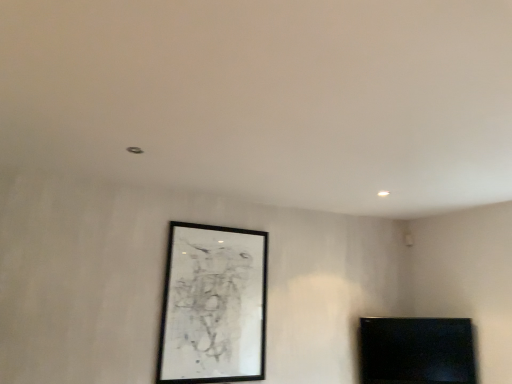
Question: Considering the positions of black matte picture frame at center and black glossy tv at lower right in the image, is black matte picture frame at center bigger or smaller than black glossy tv at lower right?

Choices:
 (A) big
 (B) small

Answer: (A)

Question: Is black matte picture frame at center inside the boundaries of black glossy tv at lower right, or outside?

Choices:
 (A) inside
 (B) outside

Answer: (B)

Question: Is point (200, 306) positioned closer to the camera than point (395, 367)?

Choices:
 (A) farther
 (B) closer

Answer: (B)

Question: From their relative heights in the image, would you say black glossy tv at lower right is taller or shorter than black matte picture frame at center?

Choices:
 (A) tall
 (B) short

Answer: (B)

Question: Considering the positions of black glossy tv at lower right and black matte picture frame at center in the image, is black glossy tv at lower right bigger or smaller than black matte picture frame at center?

Choices:
 (A) big
 (B) small

Answer: (B)

Question: Is point (448, 352) closer or farther from the camera than point (172, 331)?

Choices:
 (A) closer
 (B) farther

Answer: (B)

Question: Looking at their shapes, would you say black glossy tv at lower right is wider or thinner than black matte picture frame at center?

Choices:
 (A) wide
 (B) thin

Answer: (A)